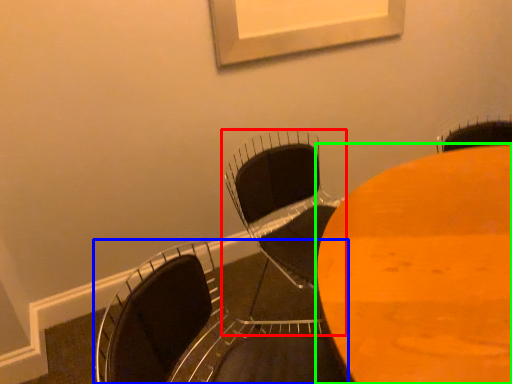
Question: Considering the real-world distances, which object is farthest from chair (highlighted by a red box)? chair (highlighted by a blue box) or table (highlighted by a green box)?

Choices:
 (A) chair
 (B) table

Answer: (A)